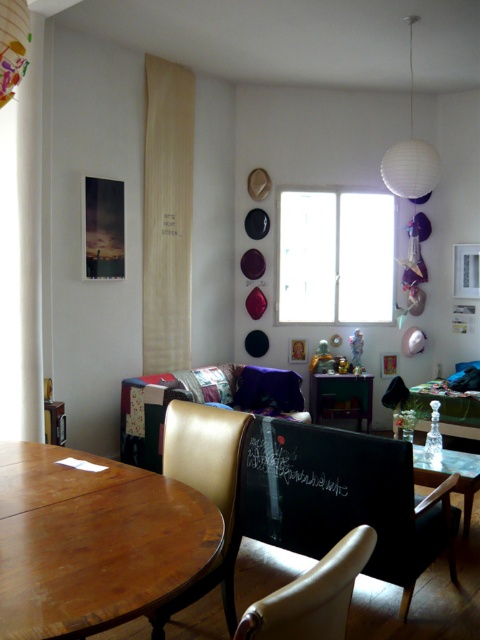
You are a delivery person carrying a large package that is 10 feet long. You need to navigate through the space between the wooden round table at lower left and the wooden curtain at upper left to reach the front door. Can you fit through the space without tilting the package?

The distance between the wooden round table at lower left and the wooden curtain at upper left is 9.76 feet. Since the package is 10 feet long, it is slightly longer than the available space, so you cannot fit through the space without tilting the package.

You are standing in the room and want to place a 1.20 meter long decorative bench behind the wooden round table at lower left. Can the bench fit behind the table without overlapping it?

The distance of wooden round table at lower left from camera is 1.10 meters. Since the bench is 1.20 meters long, it would extend beyond the table, potentially overlapping it. Therefore, the bench cannot fit without overlapping the table.